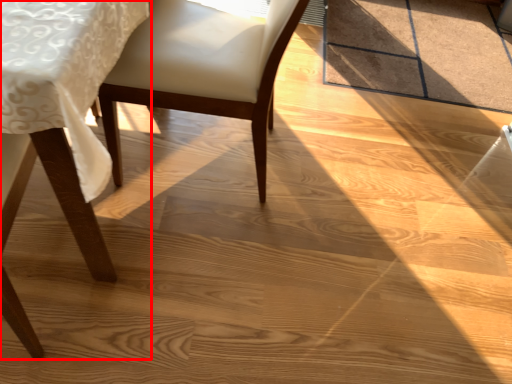
Question: In this image, where is chair (annotated by the red box) located relative to chair?

Choices:
 (A) right
 (B) left

Answer: (B)